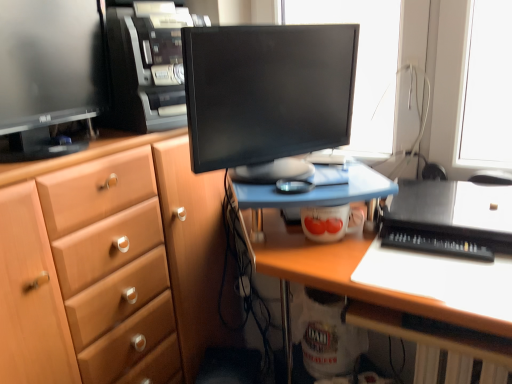
Locate an element on the screen. black plastic keyboard at lower right is located at coordinates (435, 244).

You are a GUI agent. You are given a task and a screenshot of the screen. Output one action in this format:
    pyautogui.click(x=<x>, y=<y>)
    Task: Click on the black glossy monitor at center, which is the first computer monitor in right-to-left order
    The image size is (512, 384).
    Given the screenshot: What is the action you would take?
    point(267,96)

This screenshot has width=512, height=384. What are the coordinates of `matte wood cabinet at left` in the screenshot? It's located at (110, 264).

Does matte black monitor at left, which is the first computer monitor from left to right, appear on the left side of matte wood cabinet at left?

Yes.

Is matte black monitor at left, which is the first computer monitor from left to right, wider than matte wood cabinet at left?

No.

Considering their positions, is matte black monitor at left, which is the first computer monitor from left to right, located in front of or behind matte wood cabinet at left?

matte black monitor at left, which is the first computer monitor from left to right, is positioned farther from the viewer than matte wood cabinet at left.

Is matte black monitor at left, the 2th computer monitor from the right, taller than matte wood cabinet at left?

In fact, matte black monitor at left, the 2th computer monitor from the right, may be shorter than matte wood cabinet at left.

Image resolution: width=512 pixels, height=384 pixels. I want to click on the 2nd computer monitor behind when counting from the matte wood cabinet at left, so click(x=267, y=96).

Is black glossy monitor at center, which is the first computer monitor in right-to-left order, inside the boundaries of matte wood cabinet at left, or outside?

black glossy monitor at center, which is the first computer monitor in right-to-left order, is outside matte wood cabinet at left.

Can you tell me how much black glossy monitor at center, which is the first computer monitor in right-to-left order, and matte wood cabinet at left differ in facing direction?

The facing directions of black glossy monitor at center, which is the first computer monitor in right-to-left order, and matte wood cabinet at left are 32.9 degrees apart.

Is black glossy monitor at center, which is the first computer monitor in right-to-left order, in front of or behind matte wood cabinet at left in the image?

black glossy monitor at center, which is the first computer monitor in right-to-left order, is behind matte wood cabinet at left.

Are matte black monitor at left, the 2th computer monitor from the right, and wooden desk at center beside each other?

matte black monitor at left, the 2th computer monitor from the right, and wooden desk at center are clearly separated.

This screenshot has width=512, height=384. I want to click on desk on the right of the matte black monitor at left, the 2th computer monitor from the right, so click(x=309, y=252).

From a real-world perspective, is matte black monitor at left, which is the first computer monitor from left to right, located higher than wooden desk at center?

Yes, from a real-world perspective, matte black monitor at left, which is the first computer monitor from left to right, is over wooden desk at center

Between matte black monitor at left, which is the first computer monitor from left to right, and wooden desk at center, which one appears on the left side from the viewer's perspective?

From the viewer's perspective, matte black monitor at left, which is the first computer monitor from left to right, appears more on the left side.

Is black glossy monitor at center, the second computer monitor from the left, positioned with its back to black plastic computer tower at upper center?

A: Yes, black glossy monitor at center, the second computer monitor from the left, is positioned with its back facing black plastic computer tower at upper center.

Considering the relative sizes of black glossy monitor at center, which is the first computer monitor in right-to-left order, and black plastic computer tower at upper center in the image provided, is black glossy monitor at center, which is the first computer monitor in right-to-left order, bigger than black plastic computer tower at upper center?

Correct, black glossy monitor at center, which is the first computer monitor in right-to-left order, is larger in size than black plastic computer tower at upper center.

Which object is wider, black glossy monitor at center, which is the first computer monitor in right-to-left order, or black plastic computer tower at upper center?

black plastic computer tower at upper center is wider.

Considering the points (424, 307) and (210, 115), which point is behind, point (424, 307) or point (210, 115)?

The point (210, 115) is farther.

Can you confirm if wooden desk at center is thinner than black glossy monitor at center, which is the first computer monitor in right-to-left order?

Incorrect, the width of wooden desk at center is not less than that of black glossy monitor at center, which is the first computer monitor in right-to-left order.

The image size is (512, 384). In the image, there is a black glossy monitor at center, the second computer monitor from the left. What are the coordinates of `desk below it (from the image's perspective)` in the screenshot? It's located at (309, 252).

From a real-world perspective, between wooden desk at center and black glossy monitor at center, which is the first computer monitor in right-to-left order, who is vertically lower?

wooden desk at center, from a real-world perspective.

Considering the relative sizes of wooden desk at center and matte wood cabinet at left in the image provided, is wooden desk at center shorter than matte wood cabinet at left?

Yes.

Is wooden desk at center facing away from matte wood cabinet at left?

No, wooden desk at center is not facing away from matte wood cabinet at left.

From a real-world perspective, who is located lower, wooden desk at center or matte wood cabinet at left?

In real-world perspective, wooden desk at center is lower.

From the image's perspective, is black plastic keyboard at lower right located above black glossy monitor at center, the second computer monitor from the left?

Incorrect, from the image's perspective, black plastic keyboard at lower right is lower than black glossy monitor at center, the second computer monitor from the left.

What are the coordinates of `laptop keyboard directly beneath the black glossy monitor at center, which is the first computer monitor in right-to-left order (from a real-world perspective)` in the screenshot? It's located at (435, 244).

Considering the relative positions of black plastic keyboard at lower right and black glossy monitor at center, which is the first computer monitor in right-to-left order, in the image provided, is black plastic keyboard at lower right to the right of black glossy monitor at center, which is the first computer monitor in right-to-left order, from the viewer's perspective?

Indeed, black plastic keyboard at lower right is positioned on the right side of black glossy monitor at center, which is the first computer monitor in right-to-left order.

You are a GUI agent. You are given a task and a screenshot of the screen. Output one action in this format:
    pyautogui.click(x=<x>, y=<y>)
    Task: Click on the cabinetry that appears below the matte black monitor at left, which is the first computer monitor from left to right (from the image's perspective)
    The width and height of the screenshot is (512, 384).
    Given the screenshot: What is the action you would take?
    click(110, 264)

This screenshot has height=384, width=512. Identify the location of the 1st computer monitor positioned above the matte wood cabinet at left (from a real-world perspective). (267, 96).

Based on their spatial positions, is black plastic computer tower at upper center or wooden desk at center closer to black glossy monitor at center, which is the first computer monitor in right-to-left order?

Based on the image, wooden desk at center appears to be nearer to black glossy monitor at center, which is the first computer monitor in right-to-left order.

Which object lies further to the anchor point black plastic keyboard at lower right, black glossy monitor at center, which is the first computer monitor in right-to-left order, or black plastic computer tower at upper center?

black plastic computer tower at upper center is further to black plastic keyboard at lower right.

When comparing their distances from black plastic keyboard at lower right, does matte wood cabinet at left or wooden desk at center seem further?

matte wood cabinet at left lies further to black plastic keyboard at lower right than the other object.

Considering their positions, is black plastic keyboard at lower right positioned further to matte wood cabinet at left than black glossy monitor at center, the second computer monitor from the left?

black plastic keyboard at lower right lies further to matte wood cabinet at left than the other object.

Which object lies nearer to the anchor point black plastic computer tower at upper center, black glossy monitor at center, the second computer monitor from the left, or matte wood cabinet at left?

Based on the image, black glossy monitor at center, the second computer monitor from the left, appears to be nearer to black plastic computer tower at upper center.

Considering their positions, is matte wood cabinet at left positioned closer to black glossy monitor at center, which is the first computer monitor in right-to-left order, than black plastic computer tower at upper center?

Based on the image, black plastic computer tower at upper center appears to be nearer to black glossy monitor at center, which is the first computer monitor in right-to-left order.

Considering their positions, is black plastic keyboard at lower right positioned closer to black glossy monitor at center, the second computer monitor from the left, than wooden desk at center?

wooden desk at center is closer to black glossy monitor at center, the second computer monitor from the left.

Which object lies nearer to the anchor point black glossy monitor at center, the second computer monitor from the left, matte black monitor at left, the 2th computer monitor from the right, or matte wood cabinet at left?

matte wood cabinet at left lies closer to black glossy monitor at center, the second computer monitor from the left, than the other object.

The image size is (512, 384). I want to click on cabinetry located between matte black monitor at left, which is the first computer monitor from left to right, and black plastic keyboard at lower right in the left-right direction, so click(110, 264).

Identify the location of computer monitor between matte wood cabinet at left and black plastic keyboard at lower right in the horizontal direction. (267, 96).

Locate an element on the screen. The image size is (512, 384). computer tower situated between matte black monitor at left, the 2th computer monitor from the right, and black plastic keyboard at lower right from left to right is located at coordinates click(x=147, y=66).

Where is `computer tower between matte black monitor at left, the 2th computer monitor from the right, and black glossy monitor at center, the second computer monitor from the left, from left to right`? computer tower between matte black monitor at left, the 2th computer monitor from the right, and black glossy monitor at center, the second computer monitor from the left, from left to right is located at coordinates [x=147, y=66].